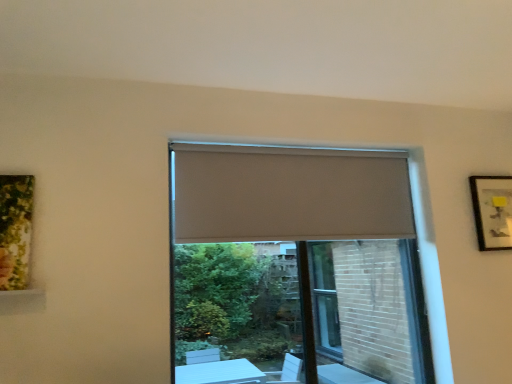
What is the approximate width of matte black picture frame at upper right?

The width of matte black picture frame at upper right is 2.14 inches.

Identify the location of beige fabric curtain at center. (289, 194).

Image resolution: width=512 pixels, height=384 pixels. What do you see at coordinates (289, 194) in the screenshot?
I see `beige fabric curtain at center` at bounding box center [289, 194].

What do you see at coordinates (368, 312) in the screenshot? I see `matte gray screen door at center` at bounding box center [368, 312].

Find the location of `matte black picture frame at upper right`. matte black picture frame at upper right is located at coordinates [492, 211].

From the image's perspective, which one is positioned lower, beige fabric window at center or matte gray screen door at center?

From the image's view, matte gray screen door at center is below.

Which object is wider, beige fabric window at center or matte gray screen door at center?

beige fabric window at center is wider.

Between beige fabric window at center and matte gray screen door at center, which one is positioned behind?

matte gray screen door at center.

Is matte gray screen door at center at the back of beige fabric window at center?

That's right, beige fabric window at center is facing away from matte gray screen door at center.

Considering the relative sizes of matte black picture frame at upper right and beige fabric curtain at center in the image provided, is matte black picture frame at upper right wider than beige fabric curtain at center?

Incorrect, the width of matte black picture frame at upper right does not surpass that of beige fabric curtain at center.

In terms of height, does matte black picture frame at upper right look taller or shorter compared to beige fabric curtain at center?

In the image, matte black picture frame at upper right appears to be shorter than beige fabric curtain at center.

Is matte black picture frame at upper right facing away from beige fabric curtain at center?

matte black picture frame at upper right is not turned away from beige fabric curtain at center.

Considering the relative positions of matte black picture frame at upper right and beige fabric curtain at center in the image provided, is matte black picture frame at upper right to the right of beige fabric curtain at center from the viewer's perspective?

Yes.

Is beige fabric window at center spatially inside beige fabric curtain at center, or outside of it?

beige fabric window at center is outside beige fabric curtain at center.

Considering the sizes of objects beige fabric window at center and beige fabric curtain at center in the image provided, who is bigger, beige fabric window at center or beige fabric curtain at center?

beige fabric window at center.

Can you confirm if beige fabric window at center is thinner than beige fabric curtain at center?

A: Yes, beige fabric window at center is thinner than beige fabric curtain at center.

Is beige fabric window at center positioned with its back to beige fabric curtain at center?

Correct, beige fabric window at center is looking away from beige fabric curtain at center.

Is matte gray screen door at center facing towards matte black picture frame at upper right?

No, matte gray screen door at center does not turn towards matte black picture frame at upper right.

How different are the orientations of matte gray screen door at center and matte black picture frame at upper right in degrees?

They differ by 0.767 degrees in their facing directions.

Is point (345, 284) in front of point (492, 243)?

No, it is not.

The width and height of the screenshot is (512, 384). I want to click on picture frame above the matte gray screen door at center (from a real-world perspective), so click(492, 211).

Is point (412, 274) less distant than point (485, 209)?

That is False.

From the image's perspective, which object appears higher, beige fabric window at center or matte black picture frame at upper right?

matte black picture frame at upper right appears higher in the image.

Is beige fabric window at center looking in the opposite direction of matte black picture frame at upper right?

beige fabric window at center does not have its back to matte black picture frame at upper right.

Would you say matte black picture frame at upper right is part of beige fabric window at center's contents?

No, matte black picture frame at upper right is not a part of beige fabric window at center.

From a real-world perspective, which object rests below the other?

matte gray screen door at center.

Does matte gray screen door at center appear on the right side of beige fabric window at center?

Indeed, matte gray screen door at center is positioned on the right side of beige fabric window at center.

What's the angular difference between matte gray screen door at center and beige fabric window at center's facing directions?

0.00277 degrees separate the facing orientations of matte gray screen door at center and beige fabric window at center.

Can you confirm if matte gray screen door at center is shorter than beige fabric curtain at center?

In fact, matte gray screen door at center may be taller than beige fabric curtain at center.

Is beige fabric curtain at center located within matte gray screen door at center?

No, beige fabric curtain at center is not surrounded by matte gray screen door at center.

Which is less distant, [345,327] or [204,146]?

Point [345,327] appears to be farther away from the viewer than point [204,146].

Is matte gray screen door at center in contact with beige fabric curtain at center?

No, matte gray screen door at center is not touching beige fabric curtain at center.

Find the location of a particular element. This screenshot has width=512, height=384. window above the matte gray screen door at center (from a real-world perspective) is located at coordinates (295, 267).

Where is `picture frame that is behind the beige fabric curtain at center`? picture frame that is behind the beige fabric curtain at center is located at coordinates (492, 211).

Estimate the real-world distances between objects in this image. Which object is closer to matte gray screen door at center, matte black picture frame at upper right or beige fabric window at center?

Based on the image, beige fabric window at center appears to be nearer to matte gray screen door at center.

Estimate the real-world distances between objects in this image. Which object is closer to matte black picture frame at upper right, matte gray screen door at center or beige fabric curtain at center?

beige fabric curtain at center is closer to matte black picture frame at upper right.

Based on the photo, from the image, which object appears to be farther from beige fabric curtain at center, matte gray screen door at center or matte black picture frame at upper right?

matte gray screen door at center is further to beige fabric curtain at center.

When comparing their distances from matte black picture frame at upper right, does beige fabric window at center or beige fabric curtain at center seem closer?

The object closer to matte black picture frame at upper right is beige fabric curtain at center.

Which object lies further to the anchor point matte gray screen door at center, beige fabric curtain at center or beige fabric window at center?

beige fabric curtain at center.

When comparing their distances from matte gray screen door at center, does matte black picture frame at upper right or beige fabric curtain at center seem closer?

matte black picture frame at upper right lies closer to matte gray screen door at center than the other object.

Based on their spatial positions, is beige fabric window at center or matte gray screen door at center further from matte black picture frame at upper right?

beige fabric window at center lies further to matte black picture frame at upper right than the other object.

Considering their positions, is beige fabric window at center positioned further to matte gray screen door at center than beige fabric curtain at center?

beige fabric curtain at center is further to matte gray screen door at center.

Image resolution: width=512 pixels, height=384 pixels. Find the location of `window between beige fabric curtain at center and matte gray screen door at center vertically`. window between beige fabric curtain at center and matte gray screen door at center vertically is located at coordinates pyautogui.click(x=295, y=267).

Where is `screen door between beige fabric curtain at center and matte black picture frame at upper right`? This screenshot has width=512, height=384. screen door between beige fabric curtain at center and matte black picture frame at upper right is located at coordinates (368, 312).

Where is `screen door between beige fabric window at center and matte black picture frame at upper right`? The image size is (512, 384). screen door between beige fabric window at center and matte black picture frame at upper right is located at coordinates (368, 312).

Locate an element on the screen. Image resolution: width=512 pixels, height=384 pixels. window between beige fabric curtain at center and matte black picture frame at upper right is located at coordinates (295, 267).